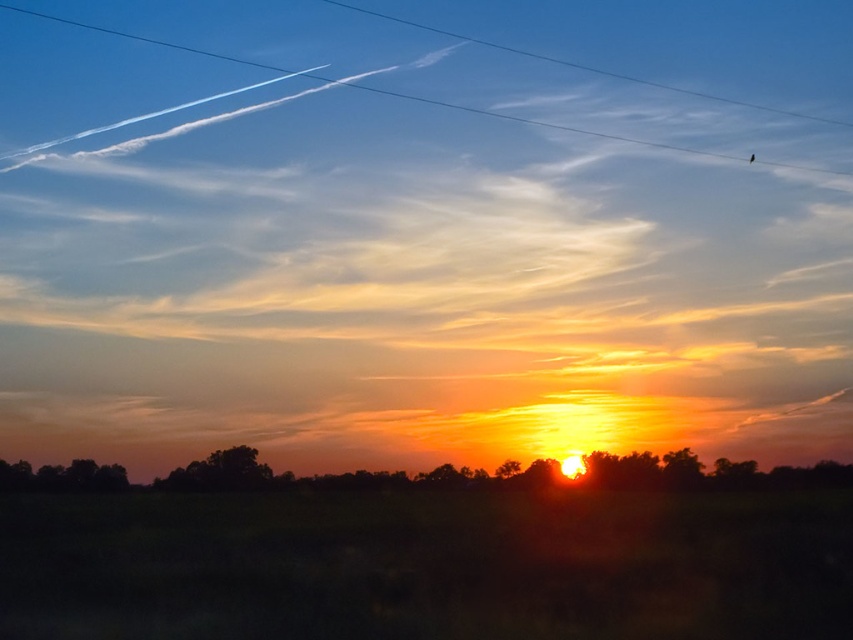
Question: Does green grass at lower center come behind silhouetted trees at center?

Choices:
 (A) no
 (B) yes

Answer: (A)

Question: Among these points, which one is farthest from the camera?

Choices:
 (A) (598, 570)
 (B) (218, 484)

Answer: (B)

Question: Is silhouetted trees at center closer to the viewer compared to clear blue wire at upper center?

Choices:
 (A) no
 (B) yes

Answer: (B)

Question: Which of the following is the farthest from the observer?

Choices:
 (A) (497, 468)
 (B) (80, 611)

Answer: (A)

Question: Which point is farther from the camera taking this photo?

Choices:
 (A) (677, 147)
 (B) (637, 566)
 (C) (1, 476)

Answer: (A)

Question: Can you confirm if green grass at lower center is positioned above clear blue wire at upper center?

Choices:
 (A) no
 (B) yes

Answer: (A)